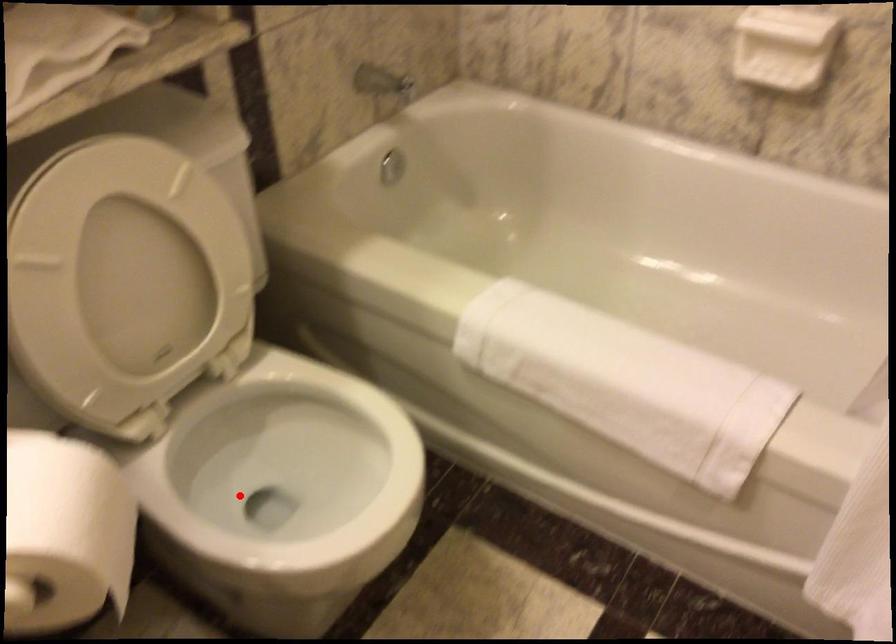
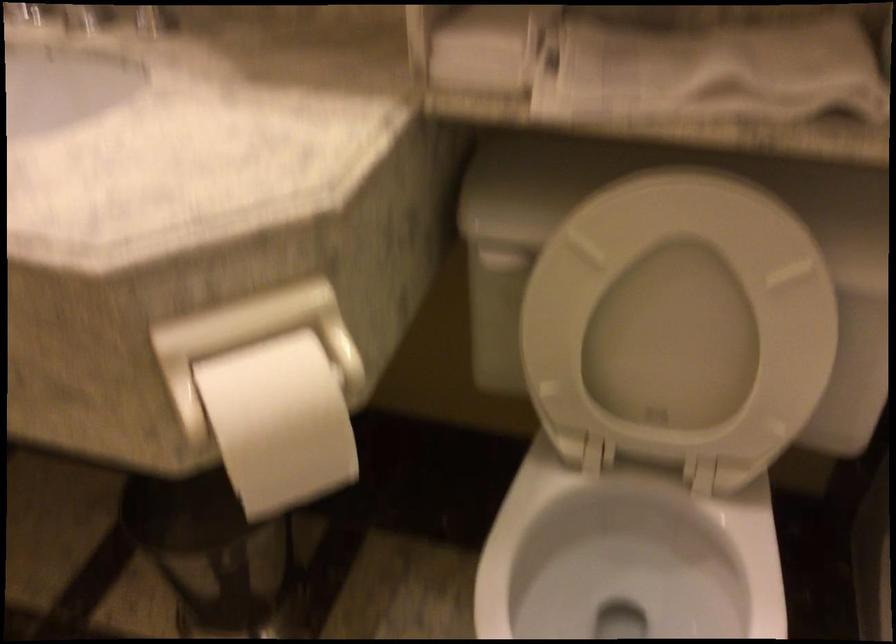
Question: I am providing you with two images of the same scene from different viewpoints. Image1 has a red point marked. In image2, the corresponding 3D location appears at what relative position? Reply with the corresponding letter.

Choices:
 (A) Closer
 (B) Farther

Answer: (A)